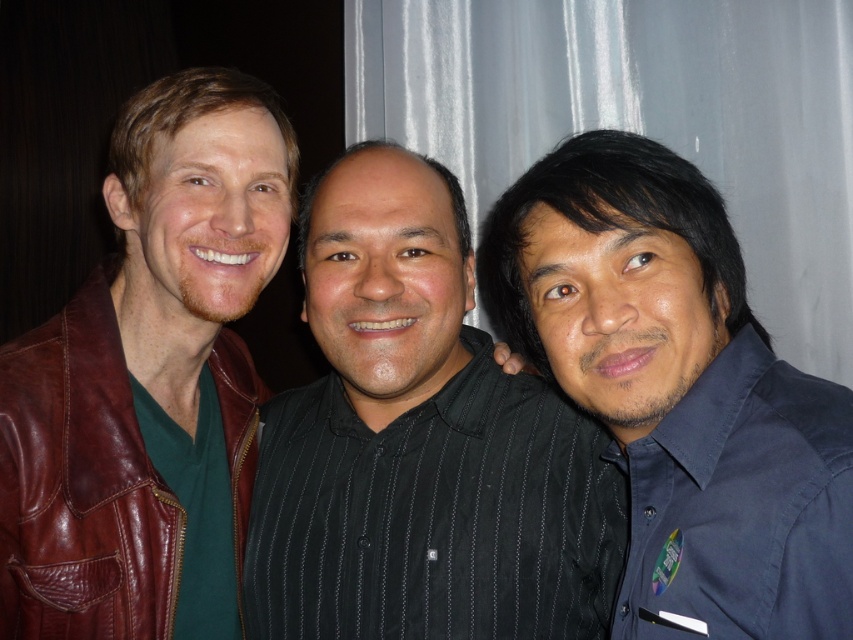
Can you confirm if black striped shirt at center is wider than brown leather jacket at left?

Indeed, black striped shirt at center has a greater width compared to brown leather jacket at left.

Describe the element at coordinates (419, 444) in the screenshot. The image size is (853, 640). I see `black striped shirt at center` at that location.

Image resolution: width=853 pixels, height=640 pixels. In order to click on black striped shirt at center in this screenshot , I will do click(x=419, y=444).

Can you confirm if dark blue shirt at right is wider than brown leather jacket at left?

Yes, dark blue shirt at right is wider than brown leather jacket at left.

Is point (625, 349) positioned in front of point (90, 388)?

Yes.

Locate an element on the screen. This screenshot has width=853, height=640. dark blue shirt at right is located at coordinates (679, 390).

Is black striped shirt at center further to the viewer compared to dark blue shirt at right?

That is True.

Is black striped shirt at center thinner than dark blue shirt at right?

Incorrect, black striped shirt at center's width is not less than dark blue shirt at right's.

What do you see at coordinates (419, 444) in the screenshot?
I see `black striped shirt at center` at bounding box center [419, 444].

Locate an element on the screen. This screenshot has height=640, width=853. black striped shirt at center is located at coordinates (419, 444).